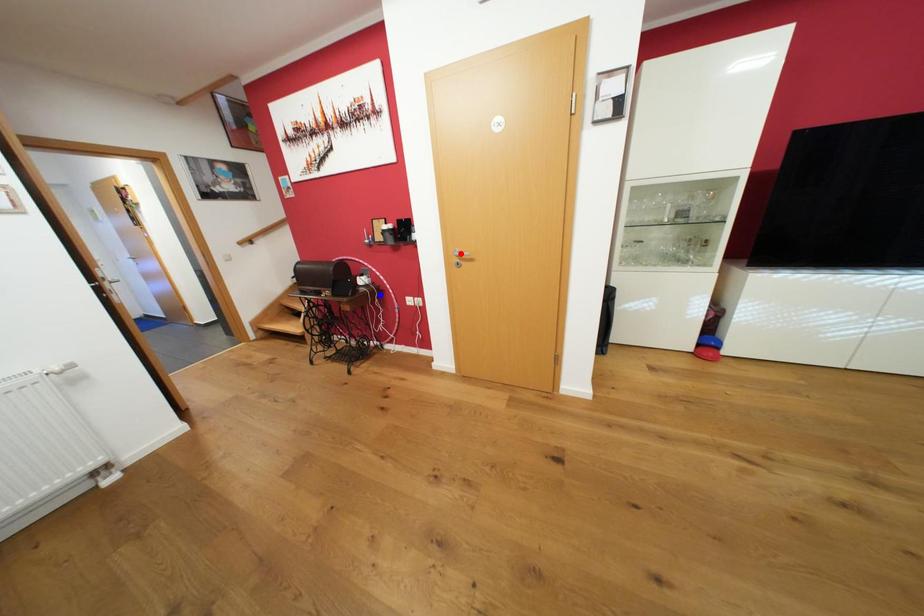
Question: Two points are marked on the image. Which point is closer to the camera?

Choices:
 (A) Blue point is closer.
 (B) Red point is closer.

Answer: (B)